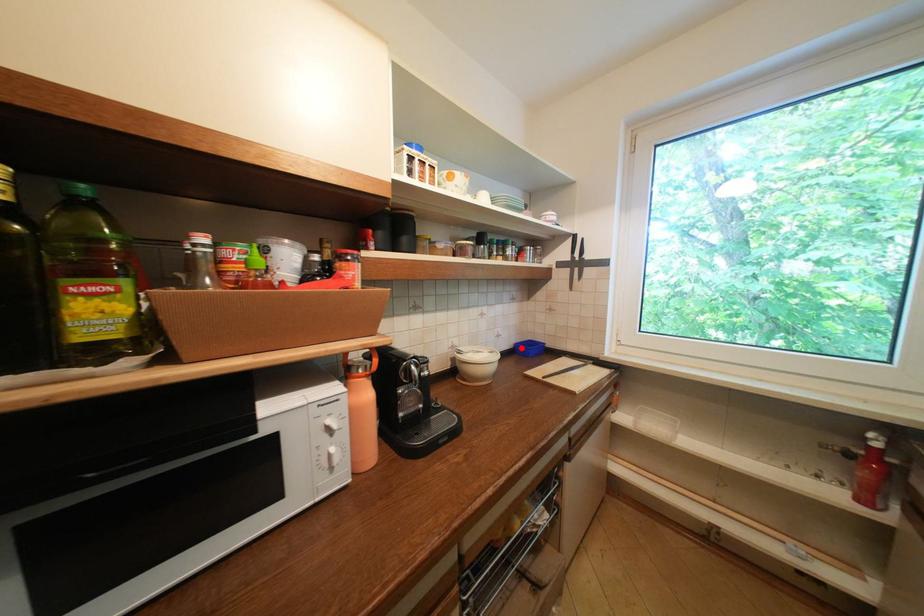
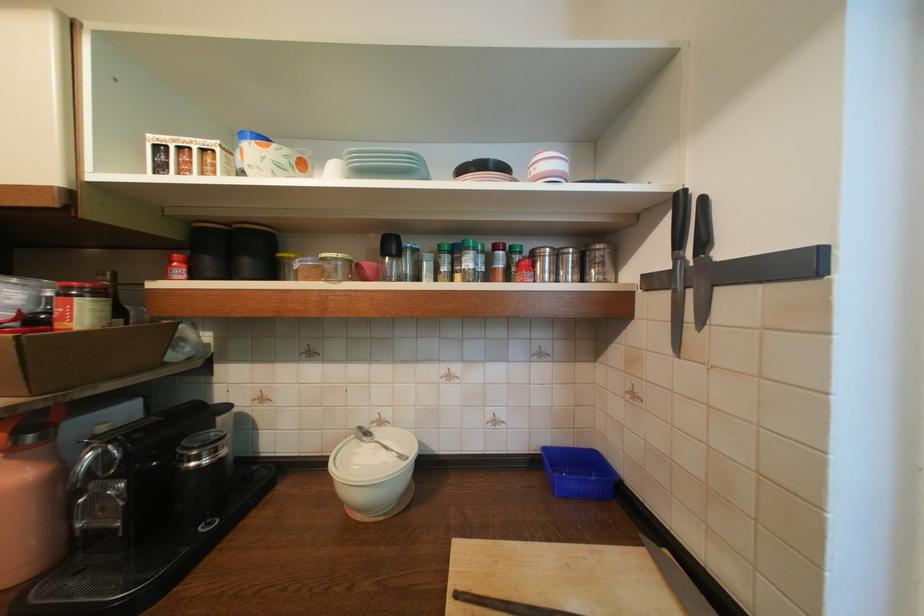
Question: I am providing you with two images of the same scene from different viewpoints. A red point is marked on the first image. At the location where the point appears in image 1, is it still visible in image 2?

Choices:
 (A) Yes
 (B) No

Answer: (A)